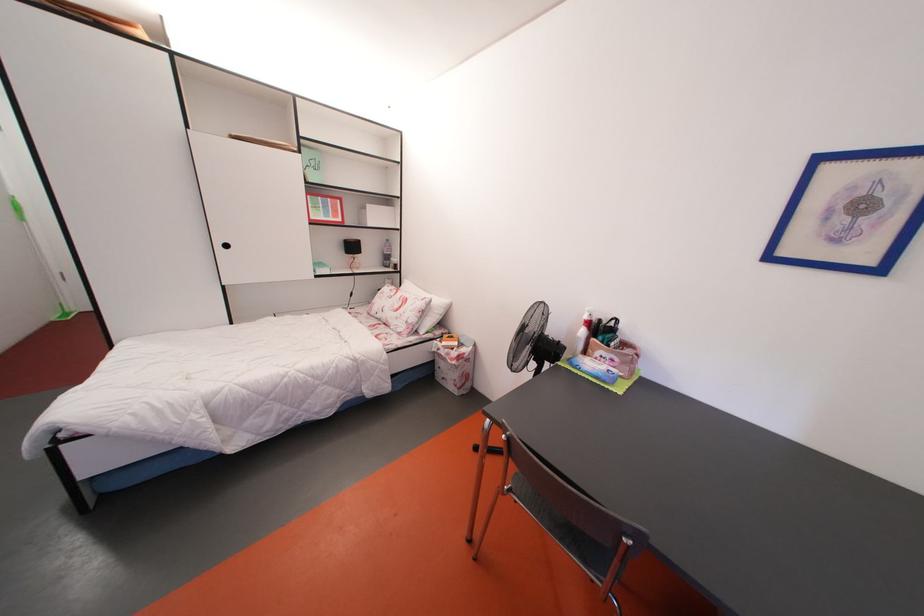
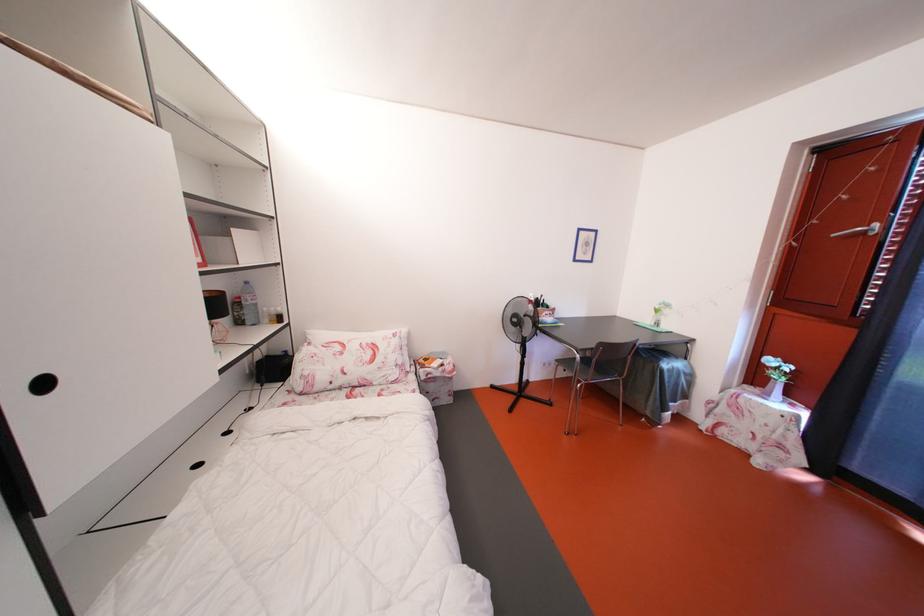
In the second image, find the point that corresponds to the point at 592,323 in the first image.

(540, 305)